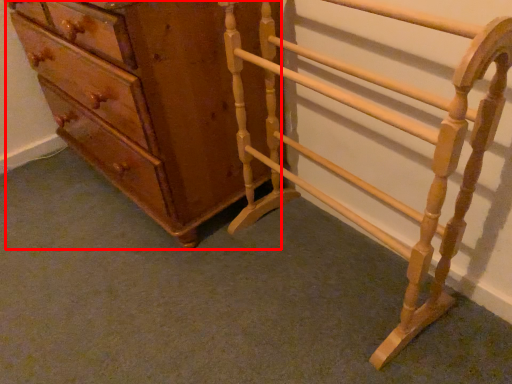
Question: From the image's perspective, where is chest of drawers (annotated by the red box) located relative to furniture?

Choices:
 (A) below
 (B) above

Answer: (B)